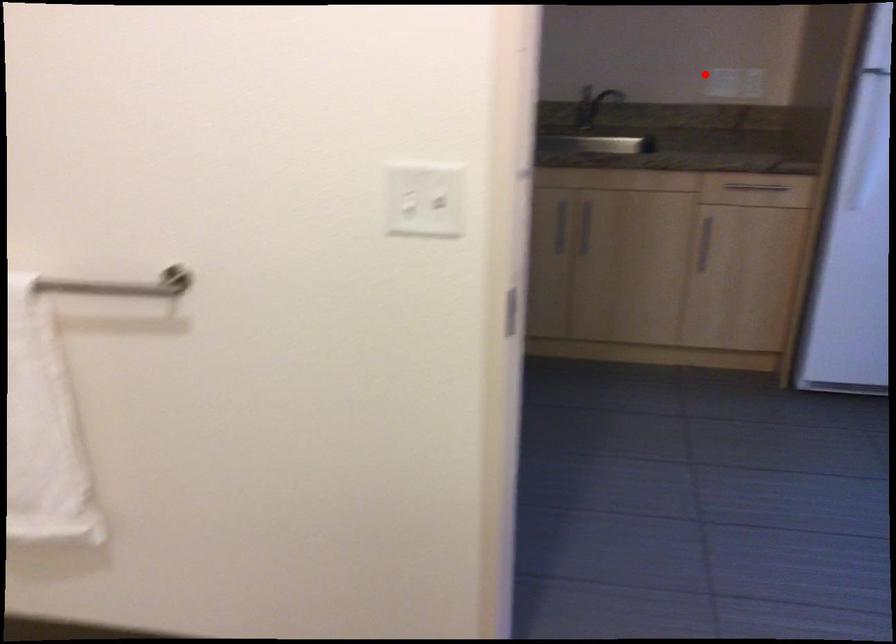
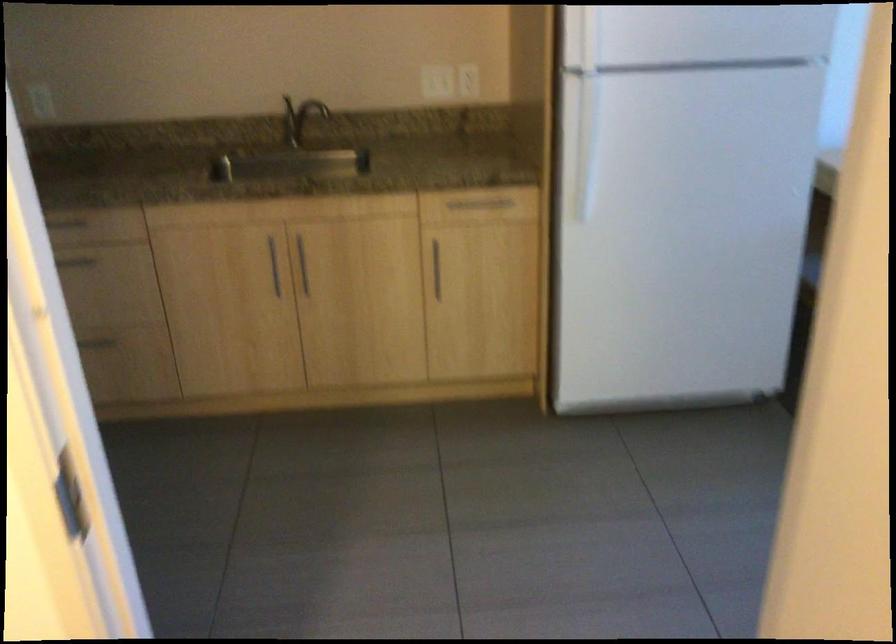
The point at the highlighted location is marked in the first image. Where is the corresponding point in the second image?

(433, 80)